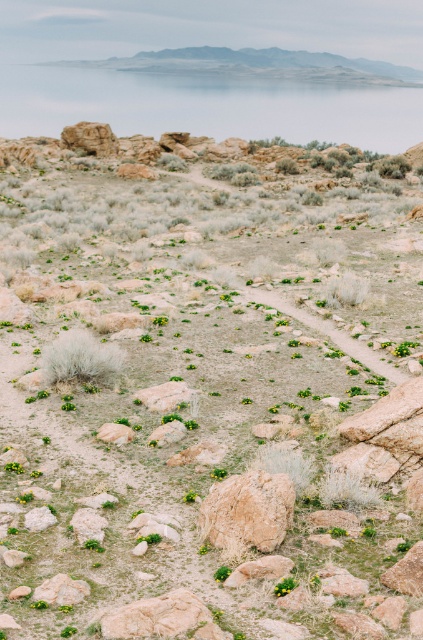
You are a hiker who wants to cross the transparent glass lake at upper center to reach the brown rough rock at center. Is the lake between you and the rock?

The transparent glass lake at upper center is above the brown rough rock at center, so the lake is between you and the rock. You cannot cross the lake to reach the rock because the lake is above it, blocking the path.

You are a hiker navigating through the desert and you spot two points of interest marked as point (x=164, y=109) and point (x=268, y=512). Which point should you head towards first if you want to reach the nearest one first?

You should head towards point (x=164, y=109) first because it is closer to you than point (x=268, y=512), which is further away.